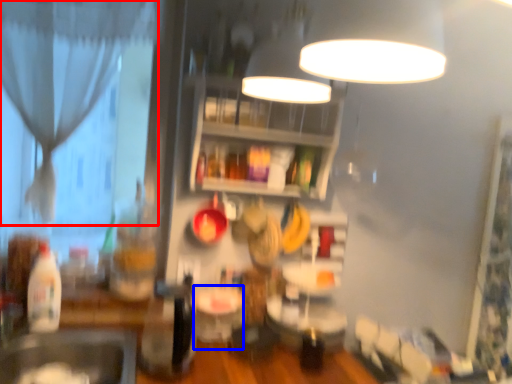
Question: Which point is closer to the camera, curtain (highlighted by a red box) or table (highlighted by a blue box)?

Choices:
 (A) curtain
 (B) table

Answer: (B)